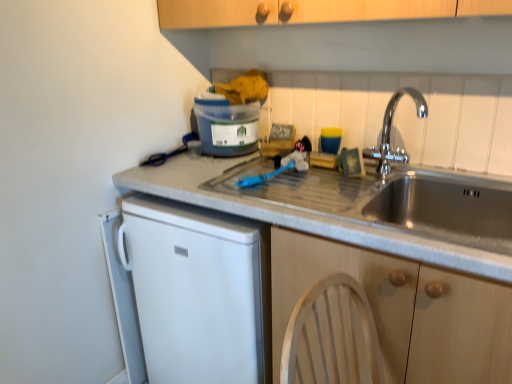
Question: Is chrome metallic faucet at upper right bigger than matte plastic container at upper center?

Choices:
 (A) no
 (B) yes

Answer: (A)

Question: Is chrome metallic faucet at upper right looking in the opposite direction of matte plastic container at upper center?

Choices:
 (A) no
 (B) yes

Answer: (A)

Question: Does chrome metallic faucet at upper right appear on the left side of matte plastic container at upper center?

Choices:
 (A) yes
 (B) no

Answer: (B)

Question: Is the position of chrome metallic faucet at upper right less distant than that of matte plastic container at upper center?

Choices:
 (A) no
 (B) yes

Answer: (B)

Question: Is chrome metallic faucet at upper right shorter than matte plastic container at upper center?

Choices:
 (A) no
 (B) yes

Answer: (A)

Question: Looking at the image, does chrome metallic faucet at upper right seem bigger or smaller compared to matte plastic container at upper center?

Choices:
 (A) big
 (B) small

Answer: (B)

Question: From a real-world perspective, relative to matte plastic container at upper center, is chrome metallic faucet at upper right vertically above or below?

Choices:
 (A) below
 (B) above

Answer: (B)

Question: Is point (419, 109) positioned closer to the camera than point (244, 140)?

Choices:
 (A) farther
 (B) closer

Answer: (B)

Question: From the image's perspective, is chrome metallic faucet at upper right located above or below matte plastic container at upper center?

Choices:
 (A) above
 (B) below

Answer: (B)

Question: Is matte plastic container at upper center taller or shorter than wooden cabinet at lower right?

Choices:
 (A) tall
 (B) short

Answer: (B)

Question: Does point (218, 117) appear closer or farther from the camera than point (330, 248)?

Choices:
 (A) closer
 (B) farther

Answer: (B)

Question: In terms of width, does matte plastic container at upper center look wider or thinner when compared to wooden cabinet at lower right?

Choices:
 (A) wide
 (B) thin

Answer: (B)

Question: Do you think matte plastic container at upper center is within wooden cabinet at lower right, or outside of it?

Choices:
 (A) outside
 (B) inside

Answer: (A)

Question: From the image's perspective, relative to matte plastic container at upper center, is wooden cabinet at lower right above or below?

Choices:
 (A) below
 (B) above

Answer: (A)

Question: Is wooden cabinet at lower right inside the boundaries of matte plastic container at upper center, or outside?

Choices:
 (A) outside
 (B) inside

Answer: (A)